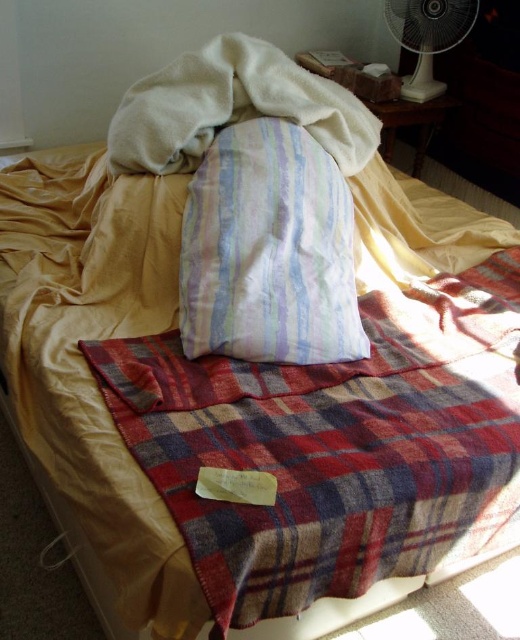
You are standing in the room and want to hang a small painting on the wall above the bed. The painting is 1 foot tall. Which object, the white soft towel at upper center or the white plastic fan at upper right, has enough vertical space to accommodate the painting without overlapping?

The white plastic fan at upper right is taller than the white soft towel at upper center, so the white plastic fan at upper right has enough vertical space to accommodate the 1 foot tall painting without overlapping.

In the scene shown: You are standing in the room and want to place a book on the tallest object between the striped fabric pillow at center and the white plastic fan at upper right. Which object should you choose?

The striped fabric pillow at center is much taller than the white plastic fan at upper right, so you should place the book on the striped fabric pillow at center.

You are trying to decide which item to use as a headrest while sitting on the bed. Based on the image, which item between the striped fabric pillow at center and the white soft towel at upper center is taller and thus more suitable for supporting your head?

The striped fabric pillow at center is taller than the white soft towel at upper center, so it would be more suitable for supporting your head as a headrest.